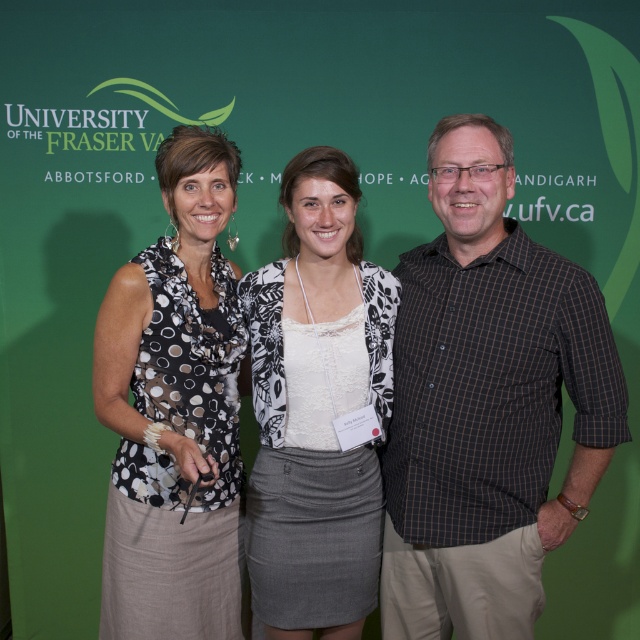
Which is more to the right, brown checkered shirt at center or black dotted blouse at left?

brown checkered shirt at center is more to the right.

Which is more to the left, brown checkered shirt at center or black dotted blouse at left?

Positioned to the left is black dotted blouse at left.

Identify the location of brown checkered shirt at center. (486, 403).

Is point (208, 566) positioned behind point (301, 570)?

That is True.

The width and height of the screenshot is (640, 640). What are the coordinates of `black dotted blouse at left` in the screenshot? It's located at (173, 410).

Does point (490, 531) lie behind point (252, 284)?

No, it is not.

Between point (480, 628) and point (257, 410), which one is positioned in front?

Point (480, 628) is in front.

This screenshot has width=640, height=640. What do you see at coordinates (486, 403) in the screenshot? I see `brown checkered shirt at center` at bounding box center [486, 403].

Identify the location of brown checkered shirt at center. (486, 403).